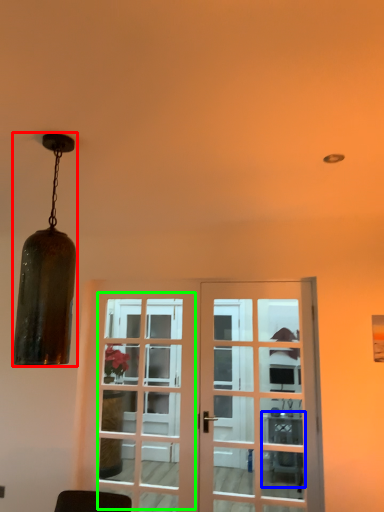
Question: Considering the real-world distances, which object is closest to lamp (highlighted by a red box)? table (highlighted by a blue box) or screen door (highlighted by a green box).

Choices:
 (A) table
 (B) screen door

Answer: (B)